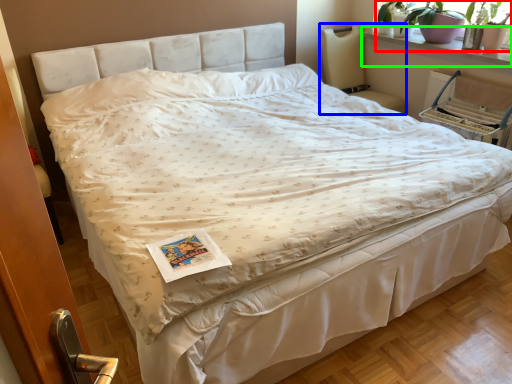
Question: Which object is the farthest from plant (highlighted by a red box)? Choose among these: rocking chair (highlighted by a blue box) or window sill (highlighted by a green box).

Choices:
 (A) rocking chair
 (B) window sill

Answer: (A)